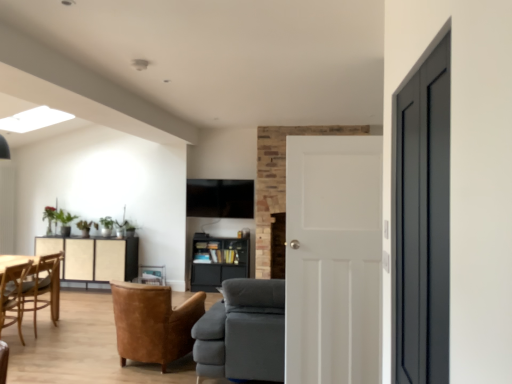
Question: In terms of width, does matte black door at right, the second door from the back, look wider or thinner when compared to white matte door at center, acting as the 1th door starting from the back?

Choices:
 (A) wide
 (B) thin

Answer: (B)

Question: From their relative heights in the image, would you say matte black door at right, which ranks as the 1th door in front-to-back order, is taller or shorter than white matte door at center, the 2th door positioned from the front?

Choices:
 (A) tall
 (B) short

Answer: (B)

Question: Estimate the real-world distances between objects in this image. Which object is farther from the matte beige cabinet at center left?

Choices:
 (A) white matte door at center, the 2th door positioned from the front
 (B) matte black bookshelf at center
 (C) leather armchair at center, the second chair in the back-to-front sequence
 (D) gray fabric couch at center
 (E) matte black door at right, which ranks as the 1th door in front-to-back order

Answer: (E)

Question: Based on their relative distances, which object is nearer to the white matte door at center, acting as the 1th door starting from the back?

Choices:
 (A) leather armchair at center, placed as the second chair when sorted from left to right
 (B) wooden chair at lower left, which is the 1th chair in back-to-front order
 (C) gray fabric couch at center
 (D) matte black door at right, the second door from the back
 (E) matte black bookshelf at center

Answer: (C)